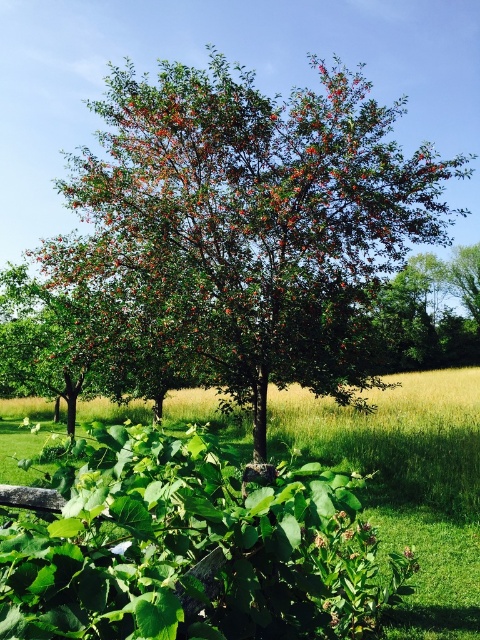
Does point (162, 116) come behind point (115, 554)?

Yes.

Does point (164, 124) come in front of point (121, 552)?

No, (164, 124) is further to viewer.

I want to click on green leafy tree at center, so click(253, 220).

This screenshot has width=480, height=640. Describe the element at coordinates (402, 412) in the screenshot. I see `green leafy bush at center` at that location.

Which is behind, point (274, 400) or point (124, 545)?

The point (274, 400) is more distant.

Is point (470, 540) positioned before point (121, 548)?

No, (470, 540) is behind (121, 548).

What are the coordinates of `green leafy bush at center` in the screenshot? It's located at (402, 412).

Between point (324, 240) and point (396, 440), which one is positioned behind?

The point (396, 440) is behind.

Is green leafy tree at center positioned behind green leafy bush at center?

Yes, green leafy tree at center is further from the viewer.

Is point (170, 128) closer to camera compared to point (424, 596)?

No, it is not.

You are a GUI agent. You are given a task and a screenshot of the screen. Output one action in this format:
    pyautogui.click(x=<x>, y=<y>)
    Task: Click on the green leafy tree at center
    Image resolution: width=480 pixels, height=640 pixels.
    Given the screenshot: What is the action you would take?
    pyautogui.click(x=253, y=220)